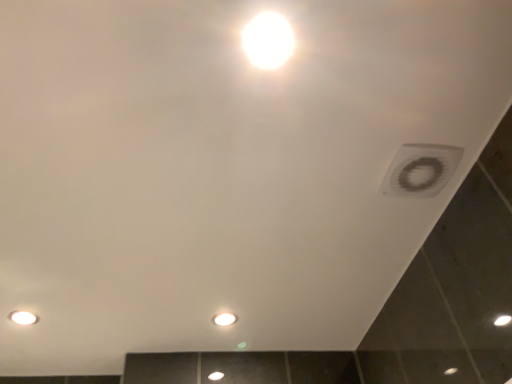
What do you see at coordinates (268, 40) in the screenshot? I see `bright white glossy light bulb at upper center, which is the 3th light bulb from bottom to top` at bounding box center [268, 40].

What is the approximate height of white glossy light bulb at center, the first light bulb in the back-to-front sequence?

It is 0.45 inches.

What is the approximate width of white glossy light bulb at center, the first light bulb in the back-to-front sequence?

3.29 inches.

Looking at this image, what is the approximate height of matte white light bulb at lower left, which is counted as the 2th light bulb, starting from the top?

1.07 centimeters.

The image size is (512, 384). In order to click on matte white light bulb at lower left, which is counted as the 2th light bulb, starting from the top in this screenshot , I will do `click(23, 318)`.

At what (x,y) coordinates should I click in order to perform the action: click on white matte vent at upper right. Please return your answer as a coordinate pair (x, y). Looking at the image, I should click on (420, 170).

Between white matte vent at upper right and matte white light bulb at lower left, the 2th light bulb when ordered from back to front, which one has larger width?

With larger width is white matte vent at upper right.

In the image, is white matte vent at upper right on the left side or the right side of matte white light bulb at lower left, the third light bulb from the right?

white matte vent at upper right is positioned on matte white light bulb at lower left, the third light bulb from the right,'s right side.

Does white matte vent at upper right have a greater height compared to matte white light bulb at lower left, which ranks as the first light bulb in left-to-right order?

Yes.

Is white matte vent at upper right oriented towards matte white light bulb at lower left, arranged as the 2th light bulb when ordered from the bottom?

No, white matte vent at upper right is not turned towards matte white light bulb at lower left, arranged as the 2th light bulb when ordered from the bottom.

Looking at this image, is white matte vent at upper right looking in the opposite direction of white glossy light bulb at center, which is the first light bulb from bottom to top?

No, white matte vent at upper right is not facing the opposite direction of white glossy light bulb at center, which is the first light bulb from bottom to top.

From the image's perspective, between white matte vent at upper right and white glossy light bulb at center, which is the first light bulb from bottom to top, who is located below?

white glossy light bulb at center, which is the first light bulb from bottom to top.

Can you tell me how much white matte vent at upper right and white glossy light bulb at center, which ranks as the 3th light bulb in top-to-bottom order, differ in facing direction?

The angular difference between white matte vent at upper right and white glossy light bulb at center, which ranks as the 3th light bulb in top-to-bottom order, is 90 degrees.

Is white matte vent at upper right at the right side of white glossy light bulb at center, marked as the 2th light bulb in a right-to-left arrangement?

Indeed, white matte vent at upper right is positioned on the right side of white glossy light bulb at center, marked as the 2th light bulb in a right-to-left arrangement.

Between white glossy light bulb at center, which ranks as the 2th light bulb in left-to-right order, and bright white glossy light bulb at upper center, positioned as the 1th light bulb in front-to-back order, which one has smaller size?

With smaller size is bright white glossy light bulb at upper center, positioned as the 1th light bulb in front-to-back order.

Looking at this image, visually, is white glossy light bulb at center, the first light bulb in the back-to-front sequence, positioned to the left or to the right of bright white glossy light bulb at upper center, positioned as the third light bulb in back-to-front order?

white glossy light bulb at center, the first light bulb in the back-to-front sequence, is to the left of bright white glossy light bulb at upper center, positioned as the third light bulb in back-to-front order.

Looking at this image, from the image's perspective, does bright white glossy light bulb at upper center, which is the 3th light bulb from bottom to top, appear lower than white matte vent at upper right?

No.

Where is `hole behind the bright white glossy light bulb at upper center, positioned as the third light bulb in back-to-front order`? This screenshot has height=384, width=512. hole behind the bright white glossy light bulb at upper center, positioned as the third light bulb in back-to-front order is located at coordinates (420, 170).

Is white matte vent at upper right completely or partially inside bright white glossy light bulb at upper center, which appears as the third light bulb when viewed from the left?

No, white matte vent at upper right is located outside of bright white glossy light bulb at upper center, which appears as the third light bulb when viewed from the left.

In terms of width, does white glossy light bulb at center, which ranks as the 3th light bulb in top-to-bottom order, look wider or thinner when compared to white matte vent at upper right?

In the image, white glossy light bulb at center, which ranks as the 3th light bulb in top-to-bottom order, appears to be more narrow than white matte vent at upper right.

Does white glossy light bulb at center, positioned as the third light bulb in front-to-back order, appear on the right side of white matte vent at upper right?

No.

From a real-world perspective, is white glossy light bulb at center, which is the first light bulb from bottom to top, on top of white matte vent at upper right?

Correct, in the physical world, white glossy light bulb at center, which is the first light bulb from bottom to top, is higher than white matte vent at upper right.

From the image's perspective, is white glossy light bulb at center, marked as the 2th light bulb in a right-to-left arrangement, over white matte vent at upper right?

No, from the image's perspective, white glossy light bulb at center, marked as the 2th light bulb in a right-to-left arrangement, is not on top of white matte vent at upper right.

From a real-world perspective, is matte white light bulb at lower left, which ranks as the first light bulb in left-to-right order, physically located above or below bright white glossy light bulb at upper center, positioned as the 1th light bulb in front-to-back order?

matte white light bulb at lower left, which ranks as the first light bulb in left-to-right order, is situated higher than bright white glossy light bulb at upper center, positioned as the 1th light bulb in front-to-back order, in the real world.

From the image's perspective, is matte white light bulb at lower left, which is counted as the 2th light bulb, starting from the top, above bright white glossy light bulb at upper center, positioned as the 1th light bulb in front-to-back order?

No.

Considering the relative sizes of matte white light bulb at lower left, arranged as the 2th light bulb when ordered from the bottom, and bright white glossy light bulb at upper center, positioned as the 1th light bulb in front-to-back order, in the image provided, is matte white light bulb at lower left, arranged as the 2th light bulb when ordered from the bottom, wider than bright white glossy light bulb at upper center, positioned as the 1th light bulb in front-to-back order,?

No, matte white light bulb at lower left, arranged as the 2th light bulb when ordered from the bottom, is not wider than bright white glossy light bulb at upper center, positioned as the 1th light bulb in front-to-back order.

How different are the orientations of matte white light bulb at lower left, which is counted as the 2th light bulb, starting from the top, and bright white glossy light bulb at upper center, the first light bulb positioned from the top, in degrees?

The angle between the facing direction of matte white light bulb at lower left, which is counted as the 2th light bulb, starting from the top, and the facing direction of bright white glossy light bulb at upper center, the first light bulb positioned from the top, is 180 degrees.

From the image's perspective, is matte white light bulb at lower left, the third light bulb from the right, under white matte vent at upper right?

Correct, matte white light bulb at lower left, the third light bulb from the right, appears lower than white matte vent at upper right in the image.

Is the depth of matte white light bulb at lower left, arranged as the 2th light bulb when ordered from the bottom, greater than that of white matte vent at upper right?

Yes.

Who is taller, matte white light bulb at lower left, arranged as the 2th light bulb when ordered from the bottom, or white matte vent at upper right?

white matte vent at upper right is taller.

Find the location of a particular element. light bulb that is the 1st object located below the white matte vent at upper right (from the image's perspective) is located at coordinates (23, 318).

There is a white matte vent at upper right. Identify the location of the 1st light bulb above it (from a real-world perspective). Image resolution: width=512 pixels, height=384 pixels. (224, 319).

Which object lies nearer to the anchor point white matte vent at upper right, matte white light bulb at lower left, arranged as the 2th light bulb when ordered from the bottom, or bright white glossy light bulb at upper center, which is the 3th light bulb from bottom to top?

bright white glossy light bulb at upper center, which is the 3th light bulb from bottom to top, is closer to white matte vent at upper right.

Based on their spatial positions, is matte white light bulb at lower left, which is counted as the 2th light bulb, starting from the top, or white glossy light bulb at center, which ranks as the 3th light bulb in top-to-bottom order, closer to bright white glossy light bulb at upper center, which is the 3th light bulb from bottom to top?

The object closer to bright white glossy light bulb at upper center, which is the 3th light bulb from bottom to top, is white glossy light bulb at center, which ranks as the 3th light bulb in top-to-bottom order.

Looking at the image, which one is located further to matte white light bulb at lower left, which is counted as the 2th light bulb, starting from the top, white glossy light bulb at center, which ranks as the 2th light bulb in left-to-right order, or white matte vent at upper right?

Based on the image, white matte vent at upper right appears to be further to matte white light bulb at lower left, which is counted as the 2th light bulb, starting from the top.

When comparing their distances from bright white glossy light bulb at upper center, positioned as the 1th light bulb in front-to-back order, does white glossy light bulb at center, which is the first light bulb from bottom to top, or matte white light bulb at lower left, arranged as the 2th light bulb when ordered from the bottom, seem further?

matte white light bulb at lower left, arranged as the 2th light bulb when ordered from the bottom, lies further to bright white glossy light bulb at upper center, positioned as the 1th light bulb in front-to-back order, than the other object.

Considering their positions, is white matte vent at upper right positioned further to bright white glossy light bulb at upper center, which appears as the third light bulb when viewed from the left, than white glossy light bulb at center, which is the first light bulb from bottom to top?

The object further to bright white glossy light bulb at upper center, which appears as the third light bulb when viewed from the left, is white glossy light bulb at center, which is the first light bulb from bottom to top.

Estimate the real-world distances between objects in this image. Which object is further from white matte vent at upper right, white glossy light bulb at center, the first light bulb in the back-to-front sequence, or matte white light bulb at lower left, which ranks as the first light bulb in left-to-right order?

matte white light bulb at lower left, which ranks as the first light bulb in left-to-right order.

Based on their spatial positions, is white glossy light bulb at center, the first light bulb in the back-to-front sequence, or bright white glossy light bulb at upper center, positioned as the third light bulb in back-to-front order, closer to white matte vent at upper right?

bright white glossy light bulb at upper center, positioned as the third light bulb in back-to-front order.

Based on their spatial positions, is bright white glossy light bulb at upper center, which is the 1th light bulb from right to left, or white glossy light bulb at center, which ranks as the 3th light bulb in top-to-bottom order, closer to matte white light bulb at lower left, which ranks as the first light bulb in left-to-right order?

white glossy light bulb at center, which ranks as the 3th light bulb in top-to-bottom order, is positioned closer to the anchor matte white light bulb at lower left, which ranks as the first light bulb in left-to-right order.

Where is `light bulb between matte white light bulb at lower left, which ranks as the first light bulb in left-to-right order, and bright white glossy light bulb at upper center, which is the 1th light bulb from right to left`? light bulb between matte white light bulb at lower left, which ranks as the first light bulb in left-to-right order, and bright white glossy light bulb at upper center, which is the 1th light bulb from right to left is located at coordinates (224, 319).

Where is `hole between bright white glossy light bulb at upper center, which is the 1th light bulb from right to left, and white glossy light bulb at center, positioned as the third light bulb in front-to-back order, from top to bottom`? hole between bright white glossy light bulb at upper center, which is the 1th light bulb from right to left, and white glossy light bulb at center, positioned as the third light bulb in front-to-back order, from top to bottom is located at coordinates (420, 170).